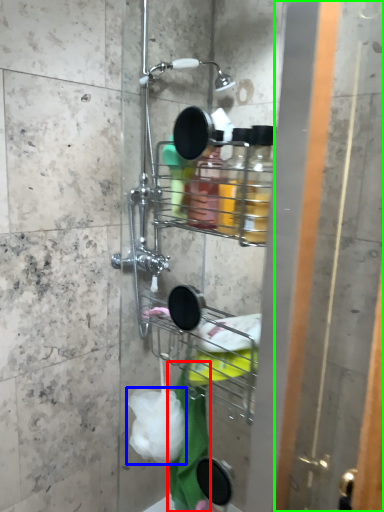
Question: Which object is the closest to the bath towel (highlighted by a red box)? Choose among these: plastic (highlighted by a blue box) or screen door (highlighted by a green box).

Choices:
 (A) plastic
 (B) screen door

Answer: (A)